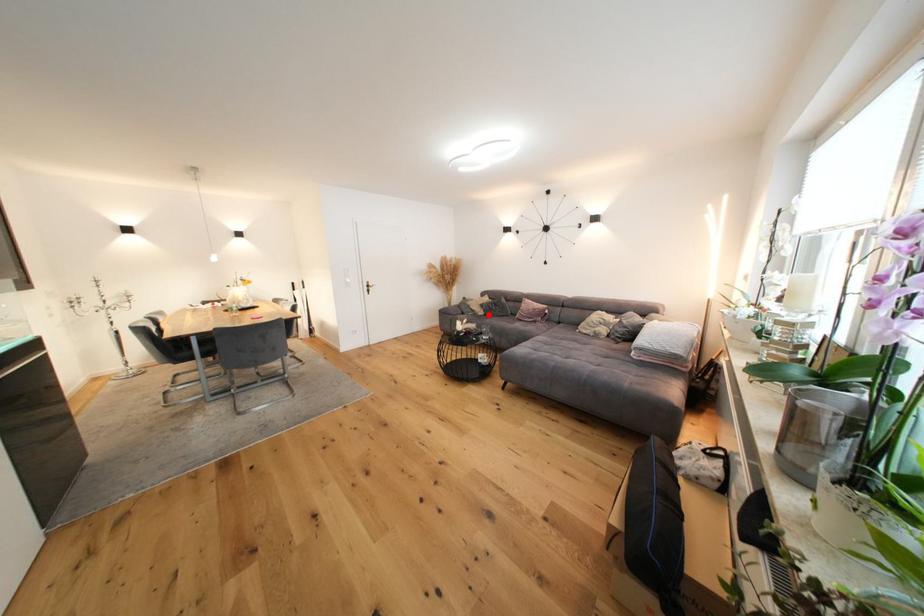
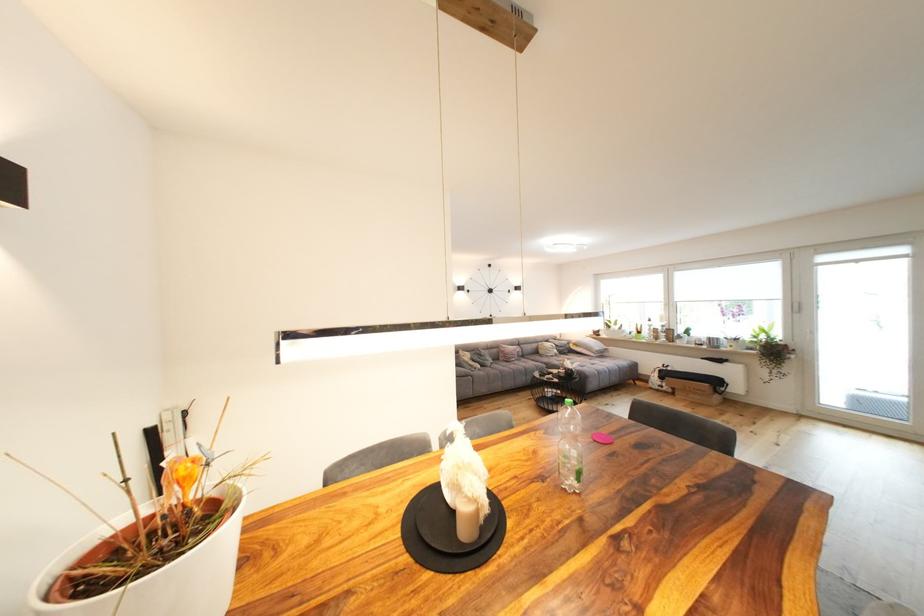
In the second image, find the point that corresponds to the highlighted location in the first image.

(485, 368)